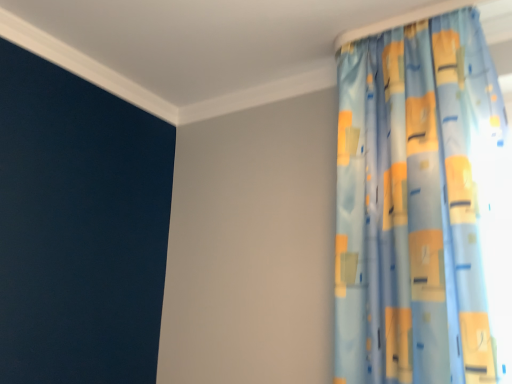
What do you see at coordinates (422, 208) in the screenshot?
I see `light blue fabric curtain at right` at bounding box center [422, 208].

Where is `light blue fabric curtain at right`? Image resolution: width=512 pixels, height=384 pixels. light blue fabric curtain at right is located at coordinates (422, 208).

I want to click on light blue fabric curtain at right, so click(422, 208).